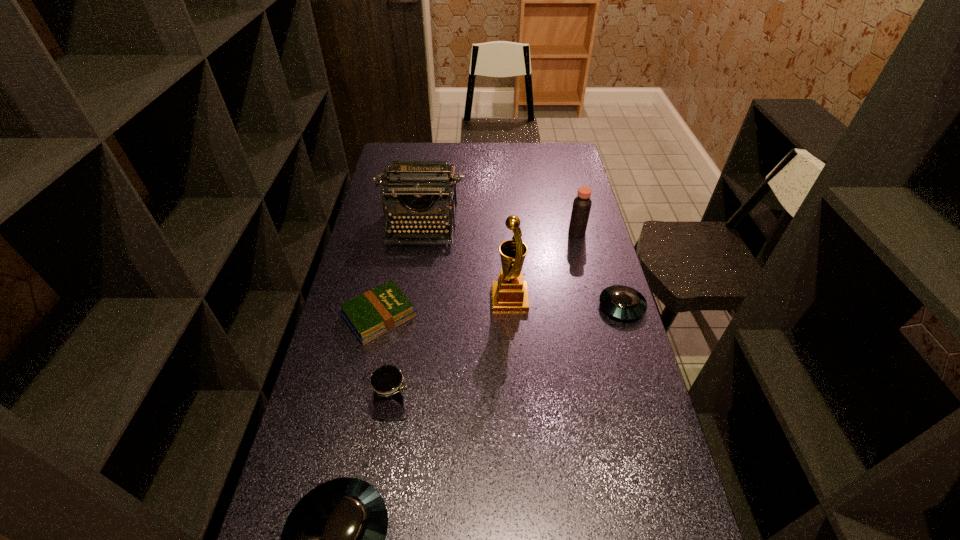
Find the location of `the farther saucer`. the farther saucer is located at coordinates (622, 302).

Find the location of `the shorter saucer`. the shorter saucer is located at coordinates (622, 302).

This screenshot has height=540, width=960. What are the coordinates of `the tallest object` in the screenshot? It's located at (510, 293).

At what (x,y) coordinates should I click in order to perform the action: click on the fifth object from left to right. Please return your answer as a coordinate pair (x, y). Looking at the image, I should click on (510, 293).

At what (x,y) coordinates should I click in order to perform the action: click on vinegar. Please return your answer as a coordinate pair (x, y). Looking at the image, I should click on tap(582, 204).

The image size is (960, 540). Identify the location of book. (376, 312).

At what (x,y) coordinates should I click in order to perform the action: click on typewriter. Please return your answer as a coordinate pair (x, y). Looking at the image, I should click on (425, 191).

This screenshot has width=960, height=540. What are the coordinates of `the fourth tallest object` in the screenshot? It's located at (390, 389).

The image size is (960, 540). Find the location of `the sixth farthest object`. the sixth farthest object is located at coordinates (390, 389).

Find the location of `vacant space situated 0.340m on the left of the shorter saucer`. vacant space situated 0.340m on the left of the shorter saucer is located at coordinates (493, 306).